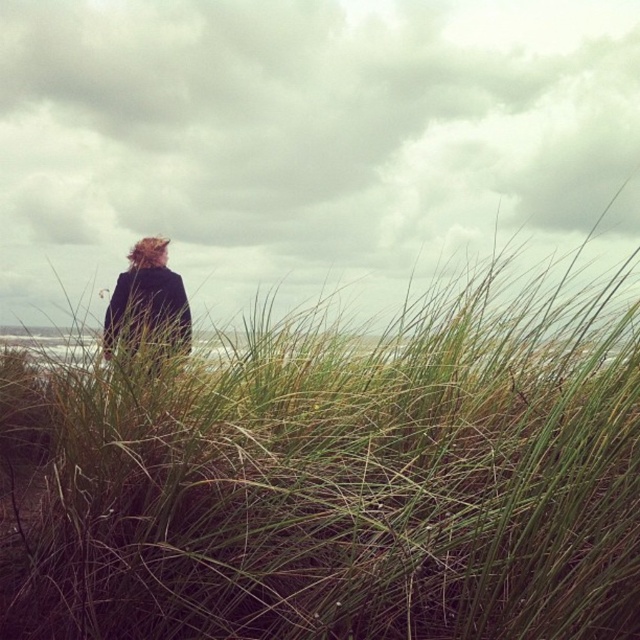
Question: In this image, where is green grassy at center located relative to dark woolen coat at center?

Choices:
 (A) left
 (B) right

Answer: (B)

Question: Does green grassy at center come in front of dark woolen coat at center?

Choices:
 (A) yes
 (B) no

Answer: (A)

Question: Which point is farther to the camera?

Choices:
 (A) dark woolen coat at center
 (B) green grassy at center

Answer: (A)

Question: Which object appears closest to the camera in this image?

Choices:
 (A) dark woolen coat at center
 (B) green grassy at center

Answer: (B)

Question: Which point is farther from the camera taking this photo?

Choices:
 (A) (540, 568)
 (B) (177, 282)

Answer: (B)

Question: Where is green grassy at center located in relation to dark woolen coat at center in the image?

Choices:
 (A) below
 (B) above

Answer: (A)